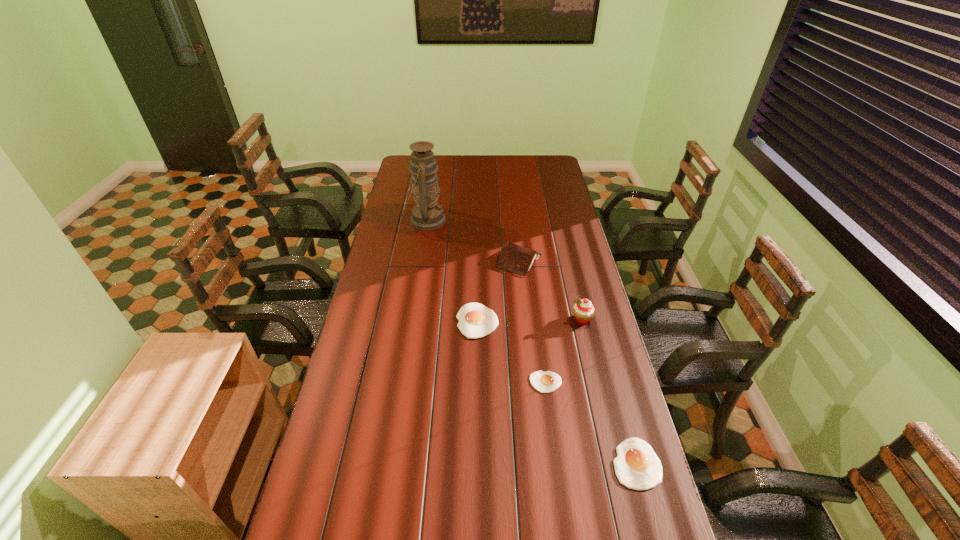
Observe the arrangement of all egg yolks in the image. To keep them evenly spaced, where would you place another egg yolk on the left? Please locate a free space. Please provide its 2D coordinates. Your answer should be formatted as a tuple, i.e. [(x, y)], where the tuple contains the x and y coordinates of a point satisfying the conditions above.

[(424, 274)]